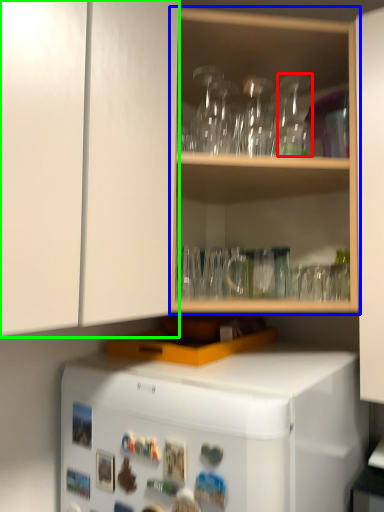
Question: Based on their relative distances, which object is farther from glass vase (highlighted by a red box)? Choose from shelf (highlighted by a blue box) and cabinetry (highlighted by a green box).

Choices:
 (A) shelf
 (B) cabinetry

Answer: (B)